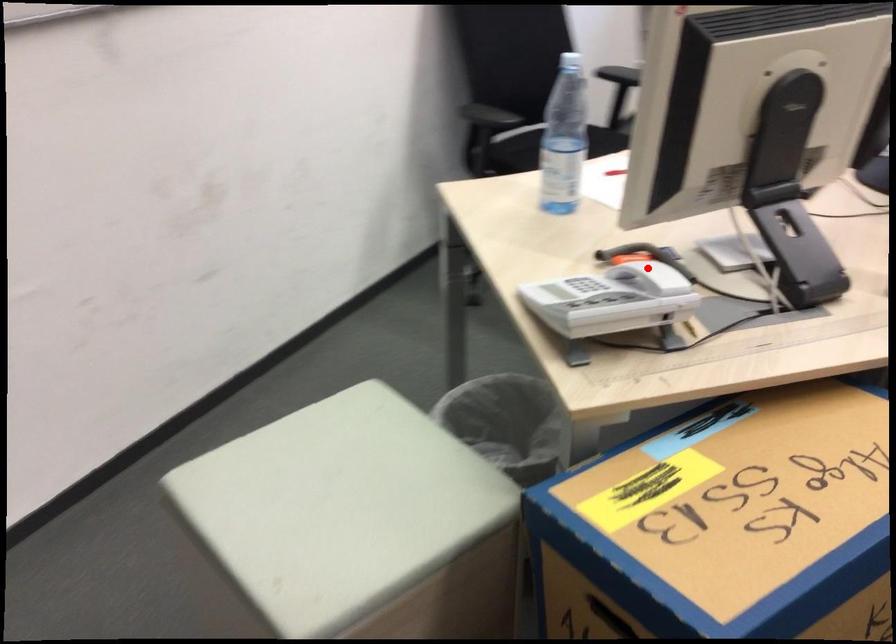
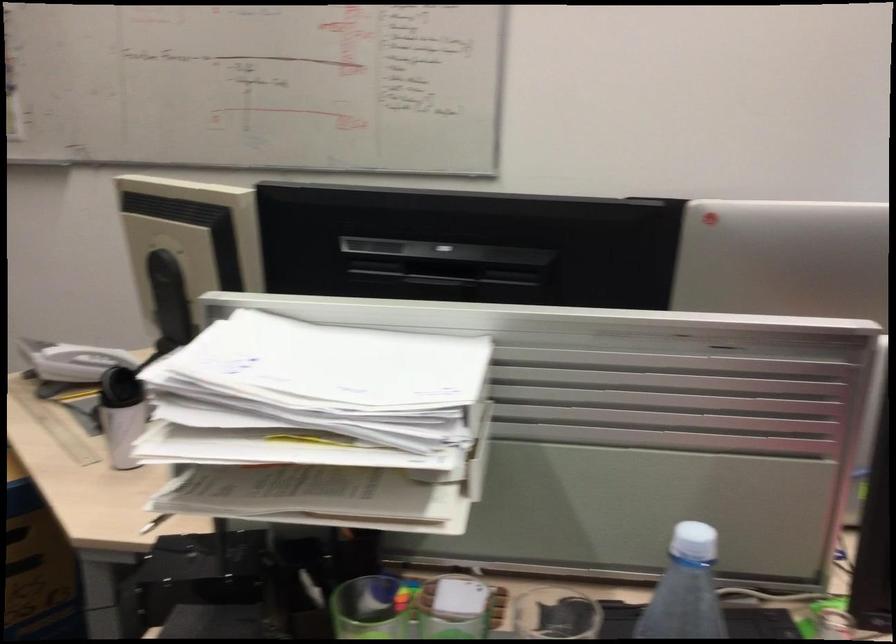
Question: I am providing you with two images of the same scene from different viewpoints. A red point is marked on the first image. Can you still see the location of the red point in image 2?

Choices:
 (A) Yes
 (B) No

Answer: (B)